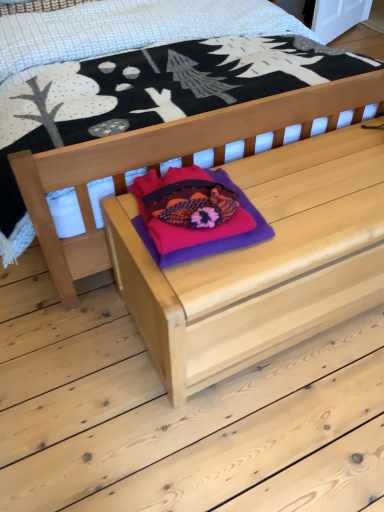
Question: Is natural wood chest at center wider or thinner than purple felt throw pillow at center?

Choices:
 (A) thin
 (B) wide

Answer: (B)

Question: In terms of height, does natural wood chest at center look taller or shorter compared to purple felt throw pillow at center?

Choices:
 (A) tall
 (B) short

Answer: (A)

Question: Estimate the real-world distances between objects in this image. Which object is farther from the natural wood chest at center?

Choices:
 (A) purple felt throw pillow at center
 (B) natural wood bed at center

Answer: (B)

Question: Which is farther from the natural wood chest at center?

Choices:
 (A) purple felt throw pillow at center
 (B) natural wood bed at center

Answer: (B)